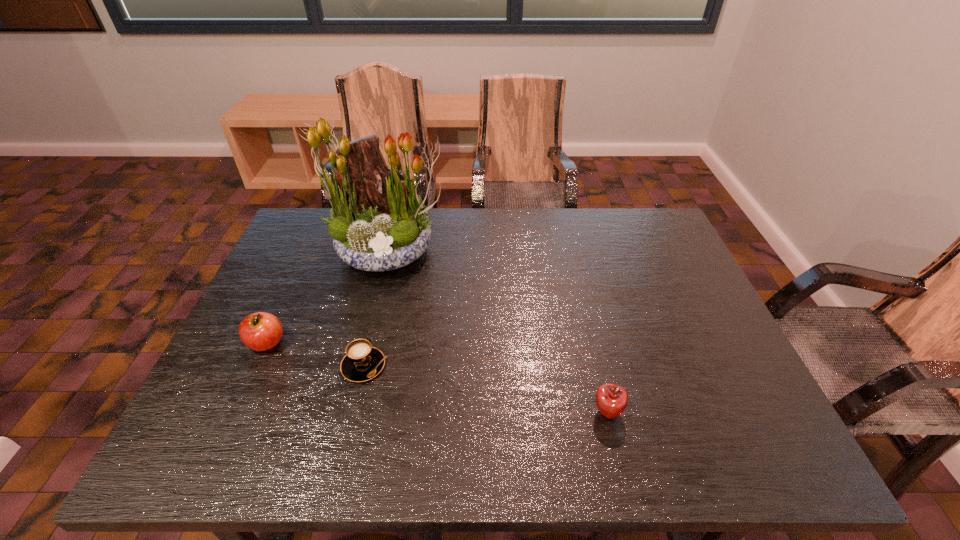
You are a GUI agent. You are given a task and a screenshot of the screen. Output one action in this format:
    pyautogui.click(x=<x>, y=<y>)
    Task: Click on the free space at the far left corner
    The image size is (960, 540).
    Given the screenshot: What is the action you would take?
    pyautogui.click(x=309, y=248)

The height and width of the screenshot is (540, 960). In the image, there is a desktop. What are the coordinates of `vacant space at the near left corner` in the screenshot? It's located at (253, 441).

What are the coordinates of `free spot at the far right corner of the desktop` in the screenshot? It's located at (640, 217).

The height and width of the screenshot is (540, 960). Find the location of `vacant area between the shortest object and the tallest object`. vacant area between the shortest object and the tallest object is located at coordinates (376, 308).

Identify the location of vacant area that lies between the nearer apple and the leftmost object. Image resolution: width=960 pixels, height=540 pixels. coord(437,378).

Locate an element on the screen. The image size is (960, 540). vacant area between the cappuccino and the rightmost object is located at coordinates (486, 389).

Locate an element on the screen. This screenshot has height=540, width=960. unoccupied area between the left apple and the rightmost object is located at coordinates pyautogui.click(x=437, y=378).

This screenshot has width=960, height=540. I want to click on vacant space that is in between the shortest object and the flower arrangement, so click(376, 308).

Identify the location of vacant region between the farthest object and the farther apple. The image size is (960, 540). (327, 297).

The height and width of the screenshot is (540, 960). In order to click on unoccupied area between the tallest object and the leftmost object in this screenshot , I will do `click(327, 297)`.